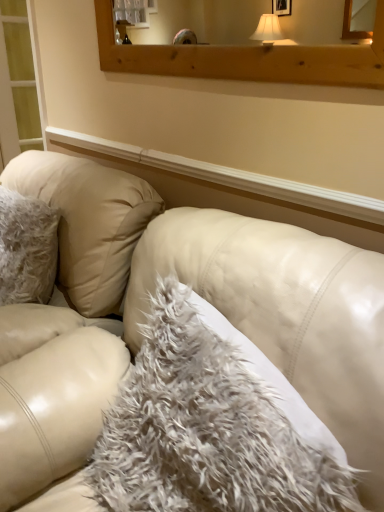
Question: Is white fluffy pillow at center turned away from translucent glass screen door at left?

Choices:
 (A) yes
 (B) no

Answer: (B)

Question: Is translucent glass screen door at left surrounded by white fluffy pillow at center?

Choices:
 (A) yes
 (B) no

Answer: (B)

Question: Is white fluffy pillow at center beside translucent glass screen door at left?

Choices:
 (A) no
 (B) yes

Answer: (A)

Question: Can you confirm if white fluffy pillow at center is positioned to the left of translucent glass screen door at left?

Choices:
 (A) no
 (B) yes

Answer: (A)

Question: Are white fluffy pillow at center and translucent glass screen door at left far apart?

Choices:
 (A) no
 (B) yes

Answer: (B)

Question: From the image's perspective, is white fluffy pillow at center under translucent glass screen door at left?

Choices:
 (A) no
 (B) yes

Answer: (B)

Question: From the image's perspective, is white leather couch at center located above white fluffy pillow at center?

Choices:
 (A) yes
 (B) no

Answer: (B)

Question: Is white leather couch at center not near white fluffy pillow at center?

Choices:
 (A) no
 (B) yes

Answer: (A)

Question: Is white leather couch at center bigger than white fluffy pillow at center?

Choices:
 (A) yes
 (B) no

Answer: (A)

Question: Does white leather couch at center have a lesser height compared to white fluffy pillow at center?

Choices:
 (A) yes
 (B) no

Answer: (B)

Question: Does white leather couch at center have a lesser width compared to white fluffy pillow at center?

Choices:
 (A) no
 (B) yes

Answer: (A)

Question: Considering the relative sizes of white leather couch at center and white fluffy pillow at center in the image provided, is white leather couch at center wider than white fluffy pillow at center?

Choices:
 (A) no
 (B) yes

Answer: (B)

Question: Is wooden frame at upper center bigger than white leather couch at center?

Choices:
 (A) no
 (B) yes

Answer: (A)